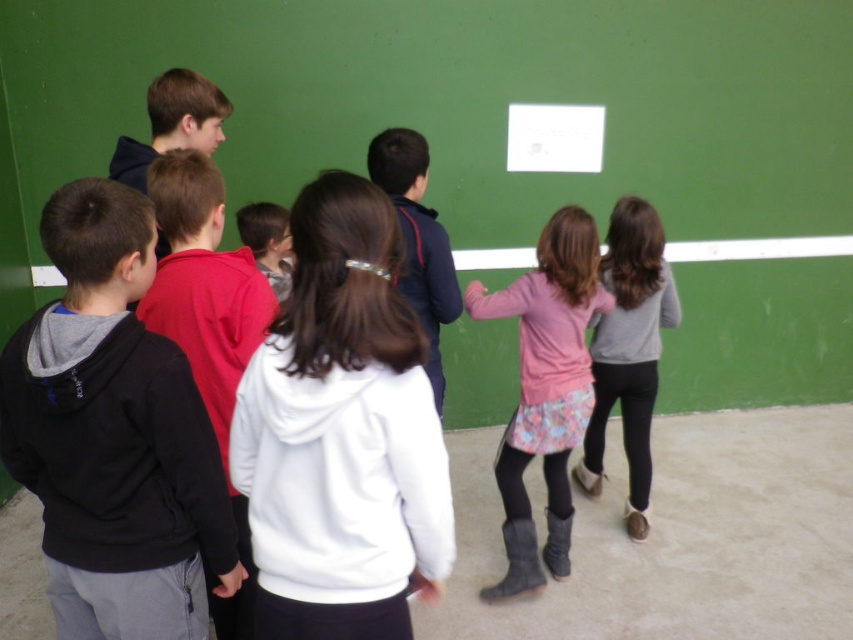
Does black hoodie at left appear on the right side of floral skirt at center?

Incorrect, black hoodie at left is not on the right side of floral skirt at center.

Which is in front, point (132, 557) or point (639, 467)?

Positioned in front is point (132, 557).

This screenshot has width=853, height=640. What are the coordinates of `black hoodie at left` in the screenshot? It's located at (114, 435).

Who is higher up, floral skirt at center or dark blue hoodie at center?

dark blue hoodie at center is above.

This screenshot has height=640, width=853. What do you see at coordinates (628, 352) in the screenshot?
I see `floral skirt at center` at bounding box center [628, 352].

This screenshot has width=853, height=640. I want to click on floral skirt at center, so click(628, 352).

Can you confirm if black hoodie at left is bigger than pink fabric skirt at center?

Actually, black hoodie at left might be smaller than pink fabric skirt at center.

Consider the image. Is black hoodie at left smaller than pink fabric skirt at center?

Indeed, black hoodie at left has a smaller size compared to pink fabric skirt at center.

Which is in front, point (171, 385) or point (527, 563)?

Point (171, 385) is more forward.

Where is `black hoodie at left`? Image resolution: width=853 pixels, height=640 pixels. black hoodie at left is located at coordinates (114, 435).